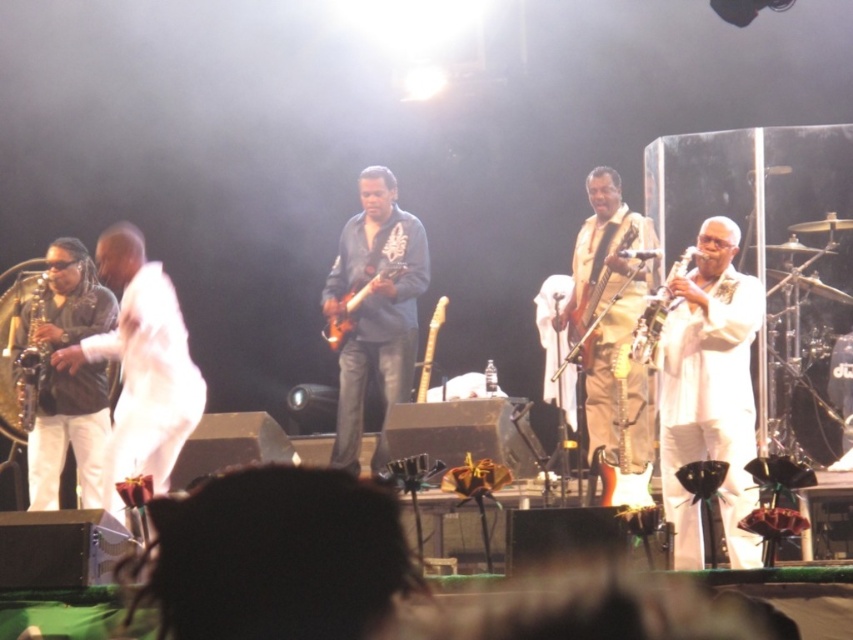
Looking at the stage, you notice two items on the far left side. Which one is closer to the center of the stage, the matte brown leather jacket at left or the matte brown saxophone at left?

The matte brown leather jacket at left is positioned on the right side of the matte brown saxophone at left, so the matte brown leather jacket at left is closer to the center of the stage.

You are a photographer trying to capture the saxophonist in the foreground. Which object, the matte brown leather jacket at left or the matte brown saxophone at left, would appear larger in your photo due to its proximity to the camera?

The matte brown leather jacket at left is closer to the viewer than the matte brown saxophone at left, so it would appear larger in the photo.

You are a photographer at the back of the venue and want to capture a photo of both the satin silver saxophone at left and the glossy electric guitar at center. Based on their positions, which instrument should you focus on first to ensure both are in frame?

The satin silver saxophone at left is to the left of the glossy electric guitar at center, so you should focus on the satin silver saxophone at left first to ensure both are in frame.